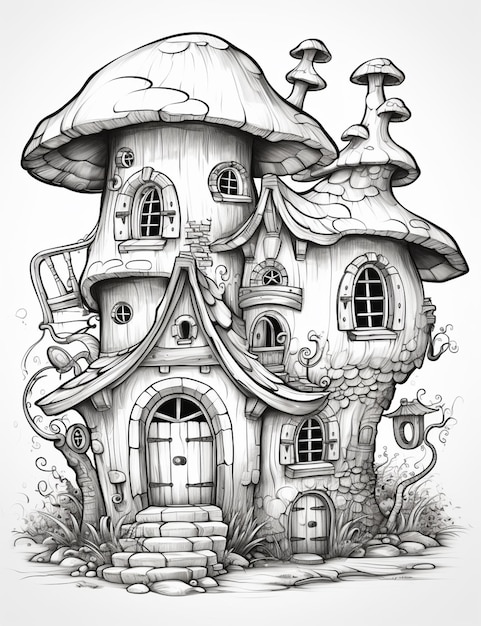
Image resolution: width=481 pixels, height=626 pixels. What are the coordinates of `doorknob` in the screenshot? It's located at (178, 459), (314, 521).